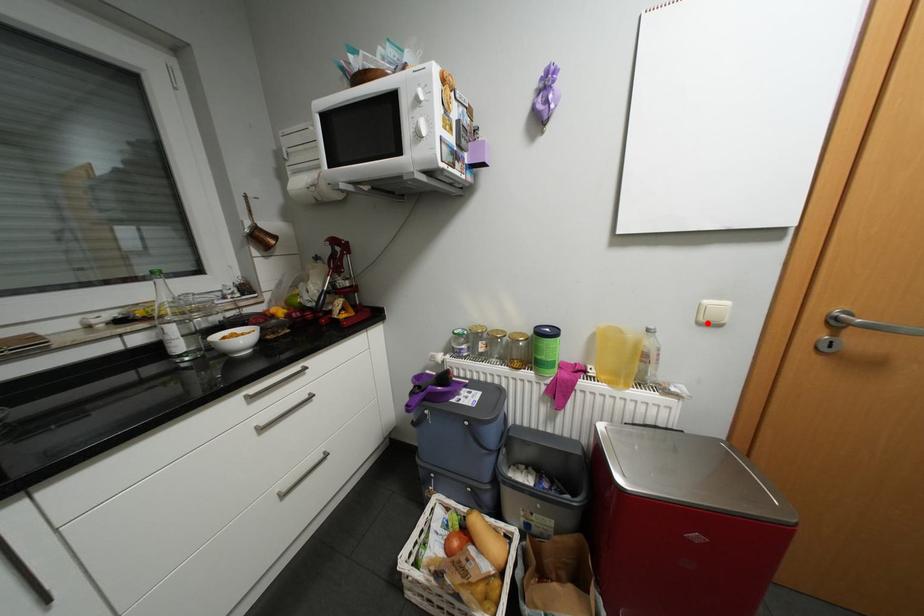
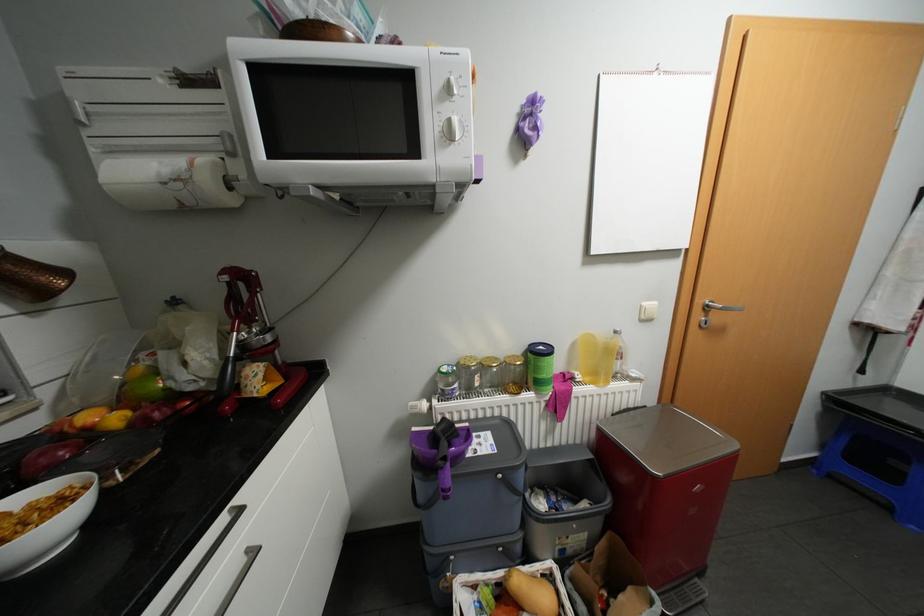
The point at the highlighted location is marked in the first image. Where is the corresponding point in the second image?

(649, 320)